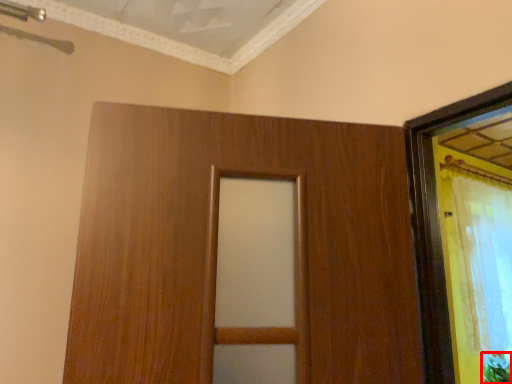
Question: Observing the image, what is the correct spatial positioning of plant (annotated by the red box) in reference to curtain?

Choices:
 (A) right
 (B) left

Answer: (A)